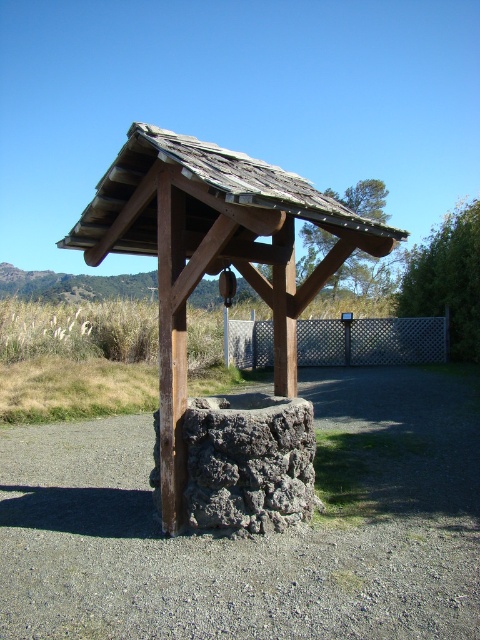
You are standing at the edge of a gravelly area and see the rustic wood gazebo at center and the weathered wood roof at center. Which structure has a greater height?

The weathered wood roof at center has a greater height than the rustic wood gazebo at center.

You are standing in front of the rustic wooden structure and want to determine the position of two points marked on the structure. Which point is closer to you, point (156, 205) or point (124, 161)?

Point (124, 161) is closer to you because it is less further to the camera than point (156, 205).